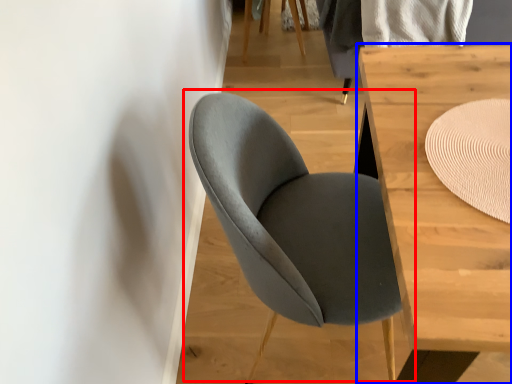
Question: Which object appears closest to the camera in this image, chair (highlighted by a red box) or table (highlighted by a blue box)?

Choices:
 (A) chair
 (B) table

Answer: (B)